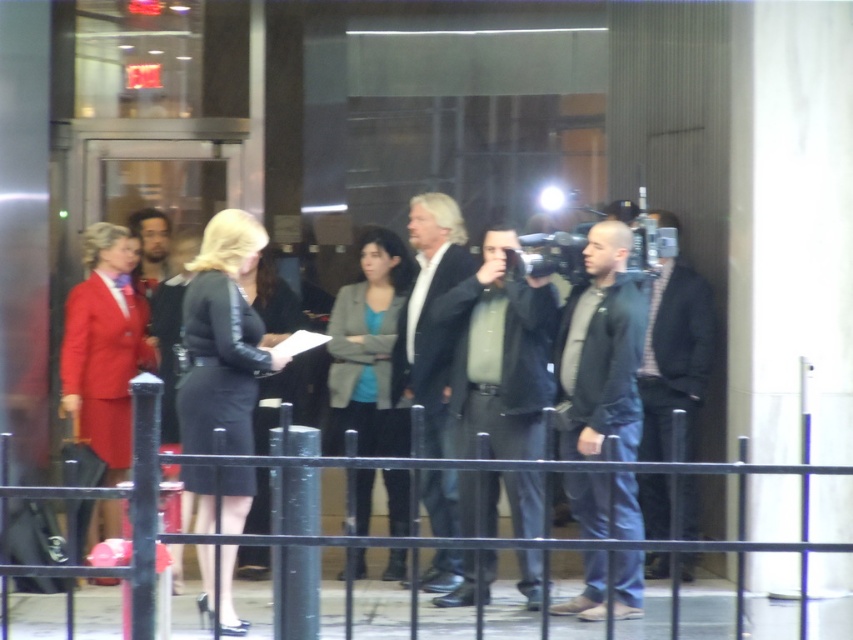
You are a photographer trying to capture a clear shot of the matte gray blazer at center and the black leather jacket at center through the window. Since the window has reflections, which clothing item might be more obscured by the reflections?

The matte gray blazer at center is positioned under the black leather jacket at center, so the reflections on the window might obscure the matte gray blazer at center more since it is lower and closer to the base of the window reflections.

You are a photographer trying to capture a clear shot of both the matte gray blazer at center and the black leather jacket at center through the glass window. Given the reflection of the interior lights, which clothing item might be easier to photograph clearly?

The matte gray blazer at center is bigger than the black leather jacket at center, so it might be easier to photograph clearly as its larger size could help overcome the reflections from the interior lights.

You are a photographer trying to capture a clear shot of the dark gray hoodie at center without the black metal fence at lower center blocking the view. Is this possible given their positions?

The dark gray hoodie at center is positioned over the black metal fence at lower center, so the fence is directly behind the hoodie and likely not blocking the view. The photographer can capture the hoodie clearly without obstruction from the fence.